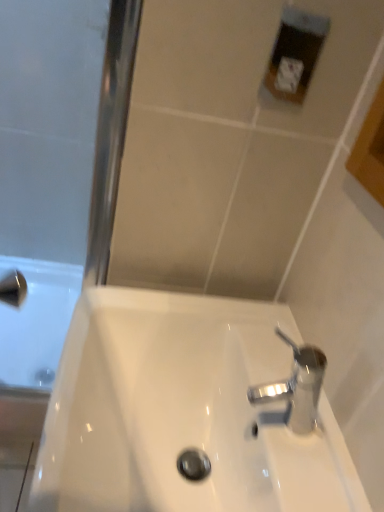
Question: From the image's perspective, relative to polished chrome tap at lower right, is white glossy sink at center above or below?

Choices:
 (A) below
 (B) above

Answer: (A)

Question: Is white glossy sink at center wider or thinner than polished chrome tap at lower right?

Choices:
 (A) thin
 (B) wide

Answer: (B)

Question: From a real-world perspective, is white glossy sink at center positioned above or below polished chrome tap at lower right?

Choices:
 (A) below
 (B) above

Answer: (A)

Question: From the image's perspective, relative to white glossy sink at center, is polished chrome tap at lower right above or below?

Choices:
 (A) above
 (B) below

Answer: (A)

Question: Which is correct: polished chrome tap at lower right is inside white glossy sink at center, or outside of it?

Choices:
 (A) inside
 (B) outside

Answer: (B)

Question: From a real-world perspective, is polished chrome tap at lower right physically located above or below white glossy sink at center?

Choices:
 (A) below
 (B) above

Answer: (B)

Question: Would you say polished chrome tap at lower right is to the left or to the right of white glossy sink at center in the picture?

Choices:
 (A) right
 (B) left

Answer: (A)